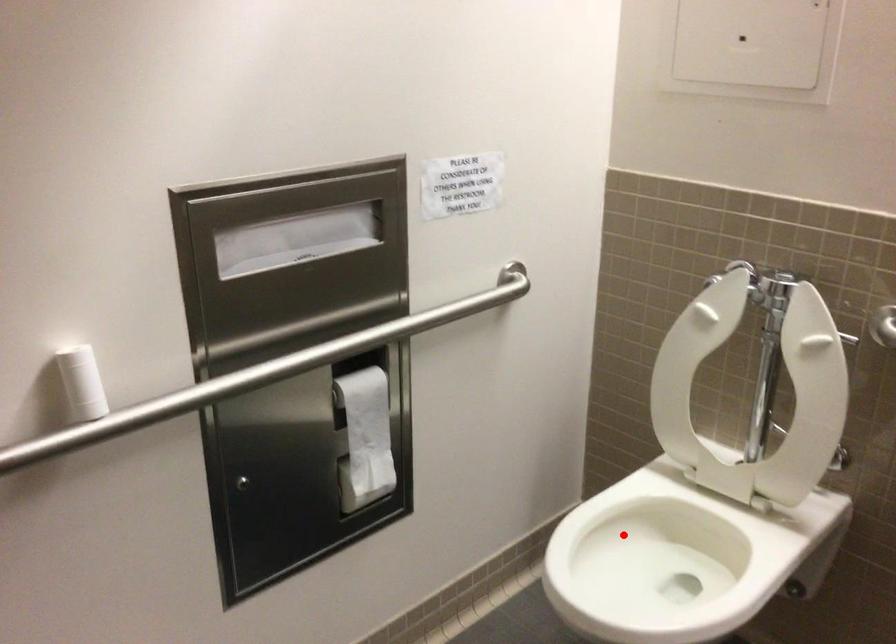
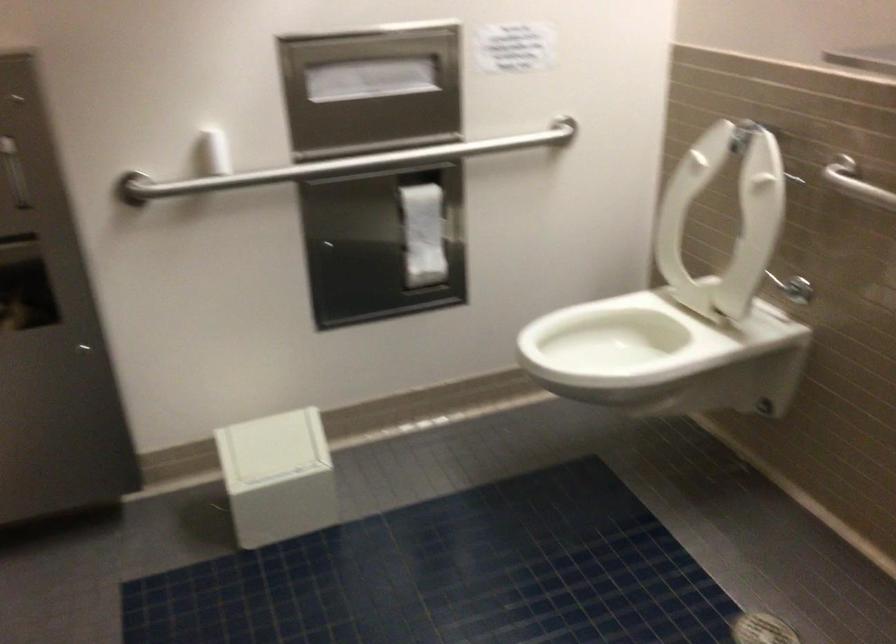
Question: I am providing you with two images of the same scene from different viewpoints. Given a red point in image1, look at the same physical point in image2. Is it:

Choices:
 (A) Closer to the viewpoint
 (B) Farther from the viewpoint

Answer: (B)